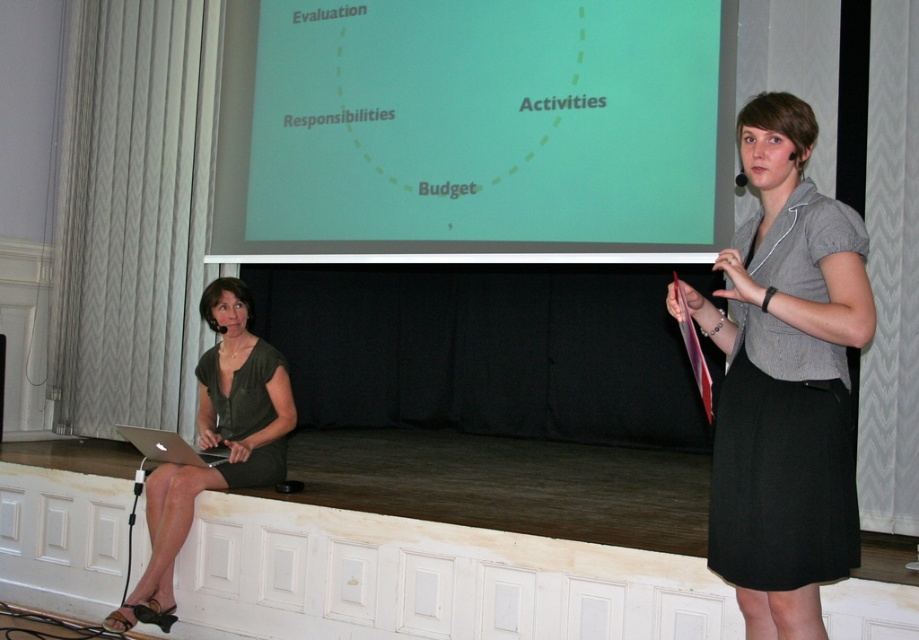
In the scene shown: Between gray fabric shirt at upper right and green matte dress at lower left, which one is positioned higher?

gray fabric shirt at upper right is above.

Consider the image. Can you confirm if gray fabric shirt at upper right is positioned to the left of green matte dress at lower left?

No, gray fabric shirt at upper right is not to the left of green matte dress at lower left.

Is point (846, 204) closer to camera compared to point (278, 424)?

Yes, it is in front of point (278, 424).

This screenshot has width=919, height=640. In order to click on gray fabric shirt at upper right in this screenshot , I will do `click(785, 381)`.

Who is more forward, (275, 440) or (0, 352)?

Point (275, 440)

Is green matte dress at lower left positioned behind matte black laptop at left?

No, it is not.

Is point (279, 458) positioned after point (0, 356)?

No, it is not.

Locate an element on the screen. The image size is (919, 640). green matte dress at lower left is located at coordinates (214, 444).

Can you confirm if green matte projection screen at center is positioned below gray fabric shirt at upper right?

Actually, green matte projection screen at center is above gray fabric shirt at upper right.

Between point (687, 243) and point (770, 298), which one is positioned behind?

Point (687, 243)

Locate an element on the screen. This screenshot has height=640, width=919. green matte projection screen at center is located at coordinates (474, 131).